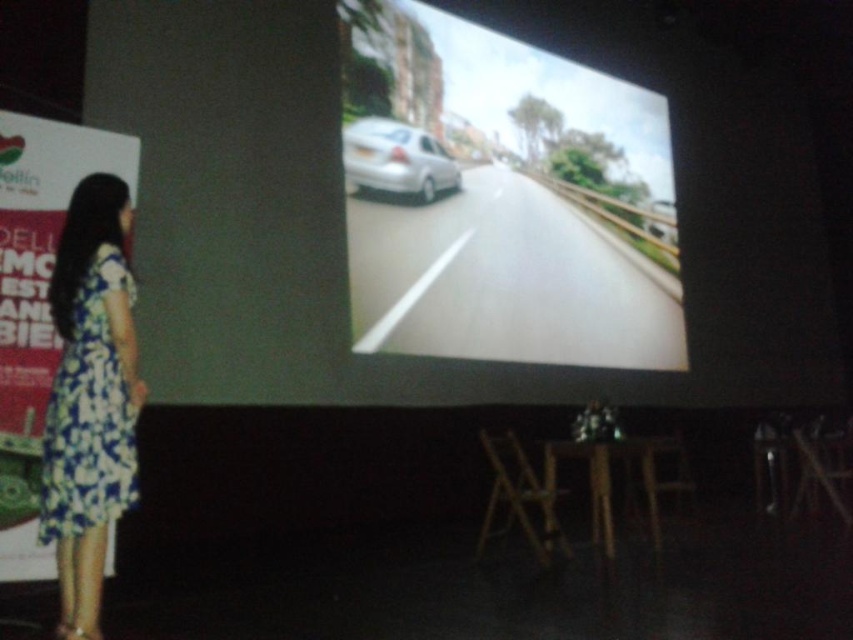
Based on the photo, is metallic silver car at center taller than satin silver sedan at center?

Correct, metallic silver car at center is much taller as satin silver sedan at center.

Consider the image. Does metallic silver car at center have a smaller size compared to satin silver sedan at center?

Incorrect, metallic silver car at center is not smaller in size than satin silver sedan at center.

What do you see at coordinates (502, 202) in the screenshot? The height and width of the screenshot is (640, 853). I see `metallic silver car at center` at bounding box center [502, 202].

At what (x,y) coordinates should I click in order to perform the action: click on metallic silver car at center. Please return your answer as a coordinate pair (x, y). The width and height of the screenshot is (853, 640). Looking at the image, I should click on (502, 202).

Does floral fabric dress at left have a greater width compared to wooden stool at lower center?

In fact, floral fabric dress at left might be narrower than wooden stool at lower center.

Does point (102, 416) lie in front of point (538, 541)?

Yes.

This screenshot has width=853, height=640. Find the location of `floral fabric dress at left`. floral fabric dress at left is located at coordinates pos(90,413).

Is satin silver sedan at center to the right of metallic silver car at right from the viewer's perspective?

Incorrect, satin silver sedan at center is not on the right side of metallic silver car at right.

Does satin silver sedan at center have a greater height compared to metallic silver car at right?

Yes.

Between point (440, 184) and point (666, 204), which one is positioned behind?

Positioned behind is point (666, 204).

You are a GUI agent. You are given a task and a screenshot of the screen. Output one action in this format:
    pyautogui.click(x=<x>, y=<y>)
    Task: Click on the satin silver sedan at center
    The width and height of the screenshot is (853, 640).
    Given the screenshot: What is the action you would take?
    pyautogui.click(x=396, y=160)